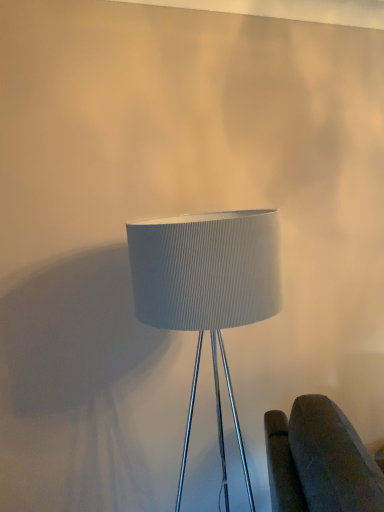
What is the approximate width of white ribbed fabric lampshade at center?

white ribbed fabric lampshade at center is 17.54 inches in width.

Image resolution: width=384 pixels, height=512 pixels. What do you see at coordinates (207, 290) in the screenshot? I see `white ribbed fabric lampshade at center` at bounding box center [207, 290].

This screenshot has width=384, height=512. Identify the location of white ribbed fabric lampshade at center. (207, 290).

This screenshot has width=384, height=512. In order to click on white ribbed fabric lampshade at center in this screenshot , I will do `click(207, 290)`.